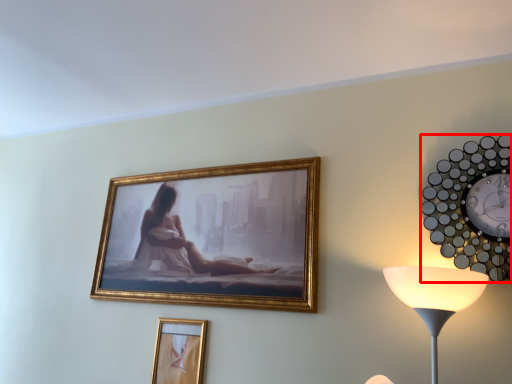
Question: From the image's perspective, what is the correct spatial positioning of wall clock (annotated by the red box) in reference to picture frame?

Choices:
 (A) below
 (B) above

Answer: (B)